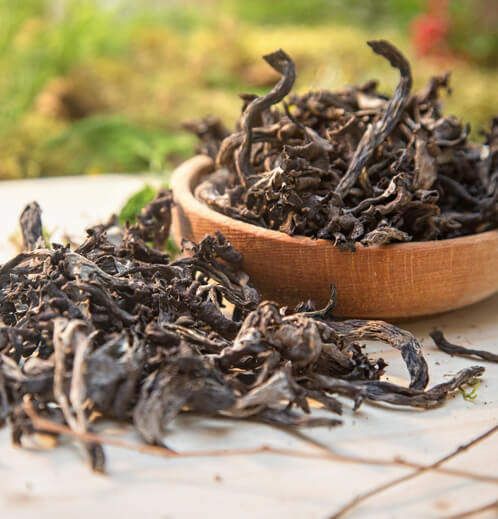
What are the coordinates of `white surface` in the screenshot? It's located at (288, 463).